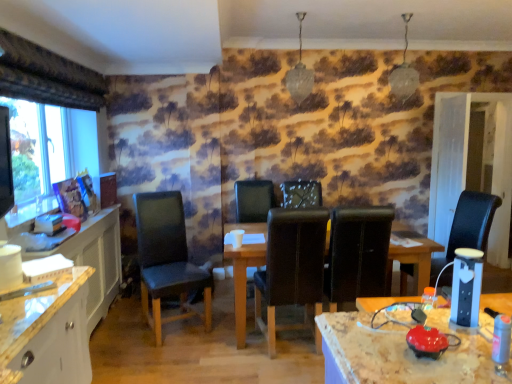
Question: Is black leather chair at center, which is the third chair in right-to-left order, shorter than wooden table at center?

Choices:
 (A) no
 (B) yes

Answer: (B)

Question: Is black leather chair at center, which is the third chair in right-to-left order, closer to camera compared to wooden table at center?

Choices:
 (A) yes
 (B) no

Answer: (B)

Question: From a real-world perspective, is black leather chair at center, the third chair viewed from the left, over wooden table at center?

Choices:
 (A) no
 (B) yes

Answer: (B)

Question: Is black leather chair at center, the third chair viewed from the left, in contact with wooden table at center?

Choices:
 (A) no
 (B) yes

Answer: (A)

Question: Is black leather chair at center, the third chair viewed from the left, further to camera compared to wooden table at center?

Choices:
 (A) yes
 (B) no

Answer: (A)

Question: Considering the relative positions of transparent glass window at left and leather at center in the image provided, is transparent glass window at left to the left or to the right of leather at center?

Choices:
 (A) left
 (B) right

Answer: (A)

Question: Is transparent glass window at left taller or shorter than leather at center?

Choices:
 (A) short
 (B) tall

Answer: (A)

Question: Relative to leather at center, is transparent glass window at left in front or behind?

Choices:
 (A) behind
 (B) front

Answer: (B)

Question: Based on their sizes in the image, would you say transparent glass window at left is bigger or smaller than leather at center?

Choices:
 (A) big
 (B) small

Answer: (B)

Question: Considering the positions of white wood computer desk at left and black leather chair at center, the third chair viewed from the left, in the image, is white wood computer desk at left bigger or smaller than black leather chair at center, the third chair viewed from the left,?

Choices:
 (A) small
 (B) big

Answer: (B)

Question: Considering the positions of white wood computer desk at left and black leather chair at center, the third chair viewed from the left, in the image, is white wood computer desk at left taller or shorter than black leather chair at center, the third chair viewed from the left,?

Choices:
 (A) tall
 (B) short

Answer: (A)

Question: From the image's perspective, is white wood computer desk at left located above or below black leather chair at center, which is the third chair in right-to-left order?

Choices:
 (A) above
 (B) below

Answer: (B)

Question: Is white wood computer desk at left situated inside black leather chair at center, the third chair viewed from the left, or outside?

Choices:
 (A) outside
 (B) inside

Answer: (A)

Question: Based on their positions, is matte black monitor at left located to the left or right of black leather chair at right, the fifth chair when ordered from left to right?

Choices:
 (A) right
 (B) left

Answer: (B)

Question: Looking at their shapes, would you say matte black monitor at left is wider or thinner than black leather chair at right, the fifth chair when ordered from left to right?

Choices:
 (A) thin
 (B) wide

Answer: (A)